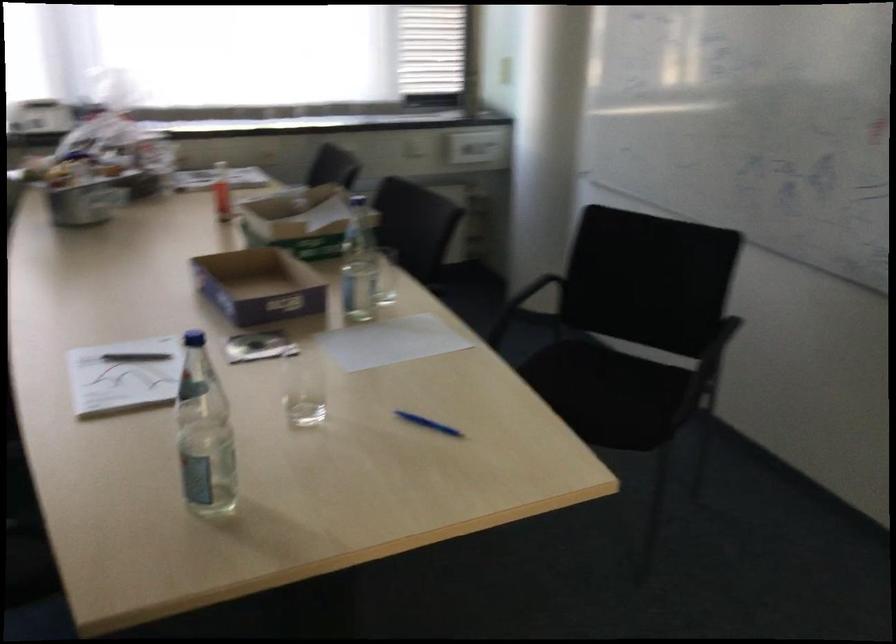
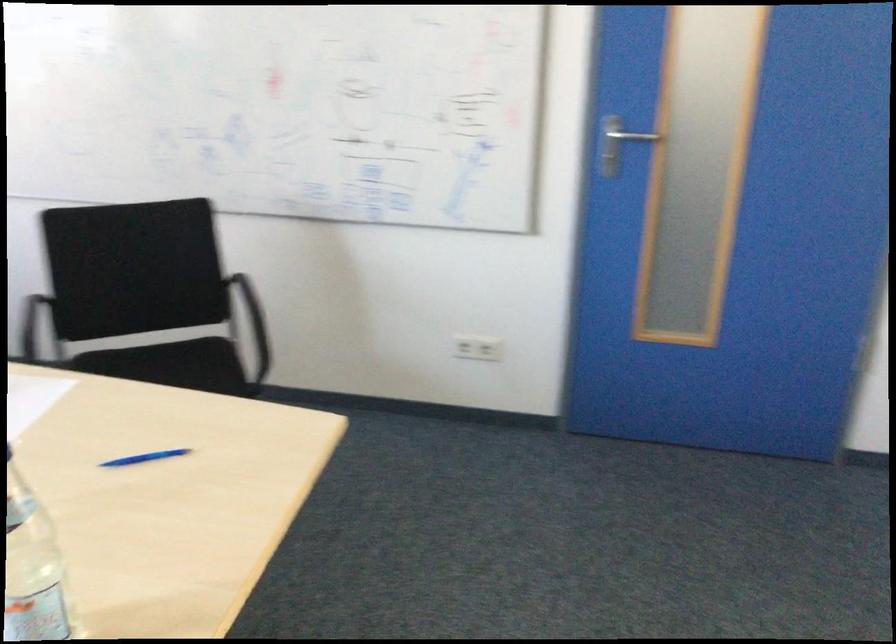
The point at (437, 431) is marked in the first image. Where is the corresponding point in the second image?

(143, 458)